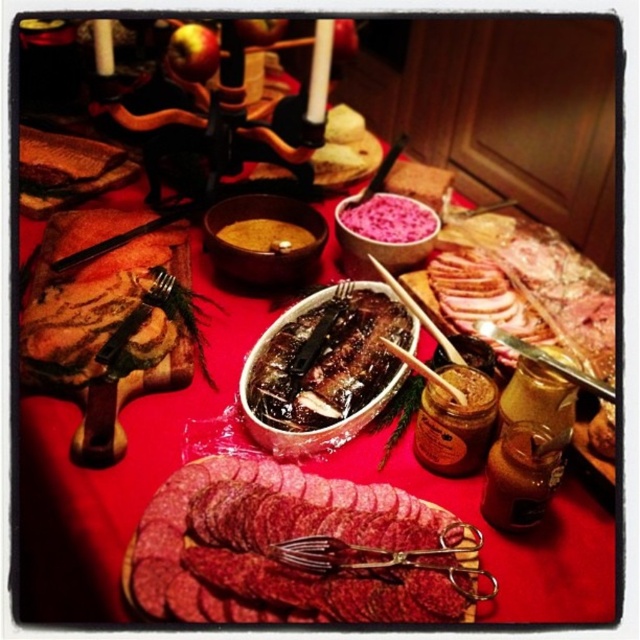
Does sliced reddish-pink cured meat at center appear under shiny dark brown meat at center?

Correct, sliced reddish-pink cured meat at center is located below shiny dark brown meat at center.

Can you confirm if sliced reddish-pink cured meat at center is positioned above shiny dark brown meat at center?

Incorrect, sliced reddish-pink cured meat at center is not positioned above shiny dark brown meat at center.

Is point (419, 592) closer to camera compared to point (284, 340)?

Yes.

The image size is (640, 640). I want to click on sliced reddish-pink cured meat at center, so click(292, 540).

Can you confirm if shiny dark brown meat at center is positioned below pink fluffy rice at center?

Correct, shiny dark brown meat at center is located below pink fluffy rice at center.

Between point (332, 304) and point (356, 202), which one is positioned in front?

Point (332, 304) is more forward.

What do you see at coordinates (326, 362) in the screenshot? This screenshot has width=640, height=640. I see `shiny dark brown meat at center` at bounding box center [326, 362].

Locate an element on the screen. This screenshot has width=640, height=640. shiny dark brown meat at center is located at coordinates (326, 362).

Does point (320, 349) come closer to viewer compared to point (257, 234)?

Yes.

Does shiny dark brown meat at center have a greater width compared to shiny brown bowl at center?

Indeed, shiny dark brown meat at center has a greater width compared to shiny brown bowl at center.

Identify the location of shiny dark brown meat at center. This screenshot has width=640, height=640. (326, 362).